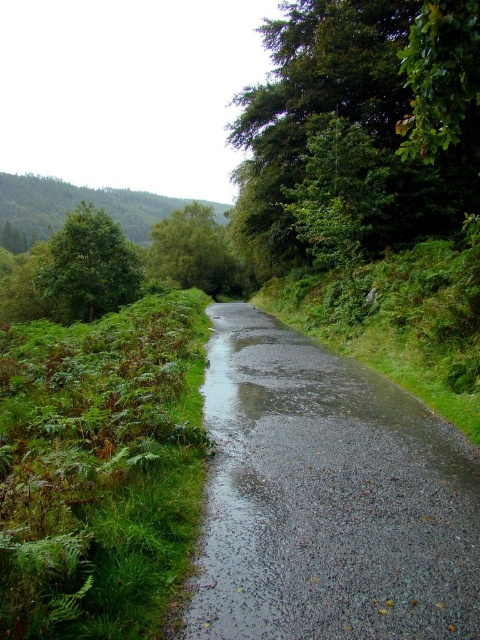
Is glossy asphalt road at center below green leafy tree at center?

Yes, glossy asphalt road at center is below green leafy tree at center.

Consider the image. Is glossy asphalt road at center closer to the viewer compared to green leafy tree at center?

Yes, it is.

Is point (220, 440) closer to viewer compared to point (166, 218)?

Yes, point (220, 440) is in front of point (166, 218).

In order to click on glossy asphalt road at center in this screenshot , I will do `click(327, 499)`.

Can you confirm if green leafy tree at upper right is taller than green leafy tree at left?

Indeed, green leafy tree at upper right has a greater height compared to green leafy tree at left.

Is green leafy tree at upper right in front of green leafy tree at left?

Yes, green leafy tree at upper right is in front of green leafy tree at left.

Locate an element on the screen. green leafy tree at upper right is located at coordinates (360, 120).

Where is `green leafy tree at upper right`? green leafy tree at upper right is located at coordinates (360, 120).

Can you confirm if glossy asphalt road at center is positioned below green leafy tree at left?

Indeed, glossy asphalt road at center is positioned under green leafy tree at left.

Is point (359, 504) behind point (108, 273)?

That is False.

Does point (227, 547) come farther from viewer compared to point (88, 257)?

No, (227, 547) is in front of (88, 257).

I want to click on glossy asphalt road at center, so click(x=327, y=499).